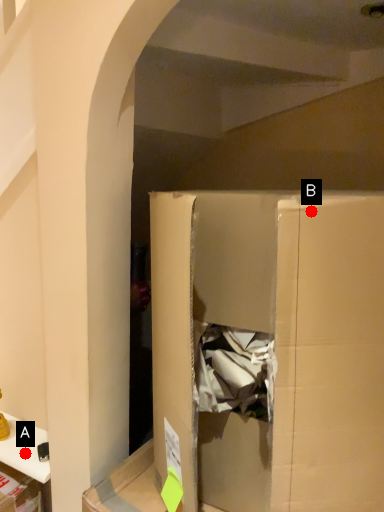
Question: Two points are circled on the image, labeled by A and B beside each circle. Which point is farther to the camera?

Choices:
 (A) A is further
 (B) B is further

Answer: (A)